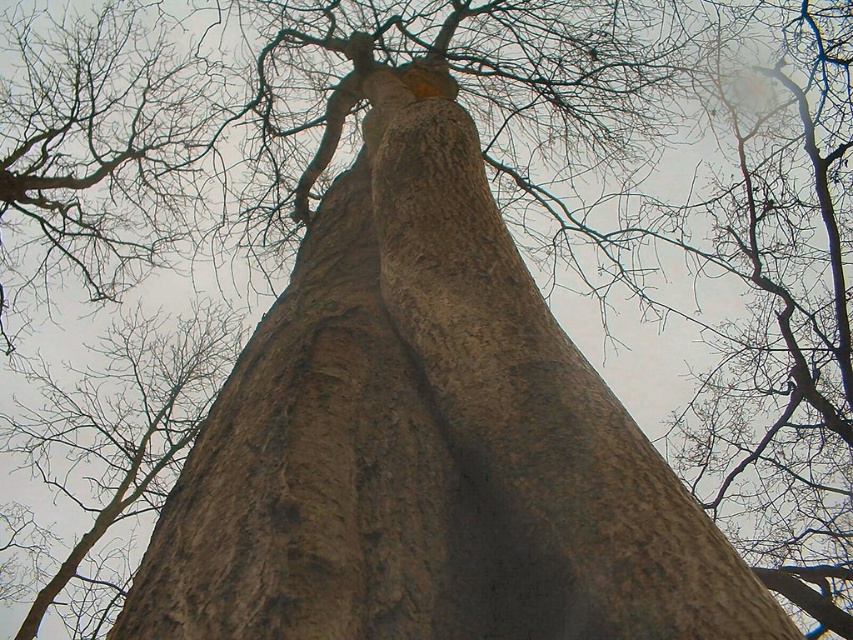
Is smooth bark tree trunk at center positioned at the back of brown rough bark at center?

No, smooth bark tree trunk at center is in front of brown rough bark at center.

Is smooth bark tree trunk at center bigger than brown rough bark at center?

No, smooth bark tree trunk at center is not bigger than brown rough bark at center.

Is point (297, 356) more distant than point (1, 436)?

No, (297, 356) is in front of (1, 436).

You are a GUI agent. You are given a task and a screenshot of the screen. Output one action in this format:
    pyautogui.click(x=<x>, y=<y>)
    Task: Click on the smooth bark tree trunk at center
    
    Given the screenshot: What is the action you would take?
    pyautogui.click(x=427, y=442)